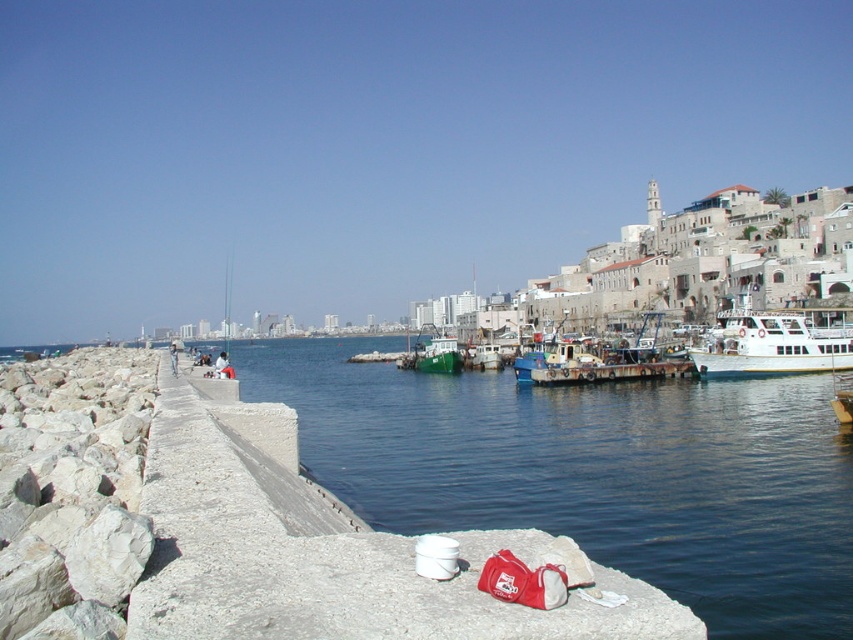
You are a photographer planning to shoot a wide shot of the waterfront scene. You have a camera that can capture a maximum width of 10 meters. The concrete at left and the green matte boat at center are both in your frame. Which object is wider in the scene?

The concrete at left is wider than the green matte boat at center.

You are standing on the walkway and want to move from the white bucket to the red bag. Which point, point (744, 356) or point (419, 348), is closer to you as you walk towards the red bag?

Point (744, 356) is closer to the viewer than point (419, 348), so it would be the closer point as you walk towards the red bag.

You are standing on the walkway and want to place a heavy object on the surface. Which location would be more stable between the concrete at left and the white glossy boat at right?

The concrete at left is much taller than the white glossy boat at right, making it a more stable surface for placing heavy objects.